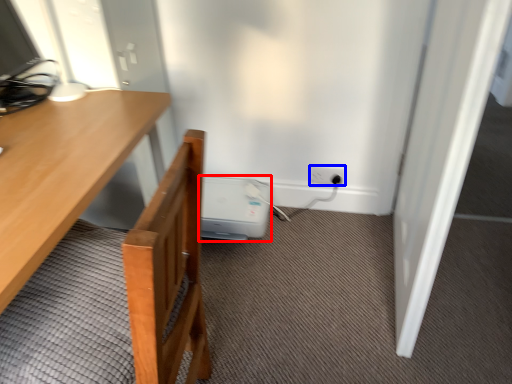
Question: Which of the following is the closest to the observer, water heater (highlighted by a red box) or electric outlet (highlighted by a blue box)?

Choices:
 (A) water heater
 (B) electric outlet

Answer: (A)